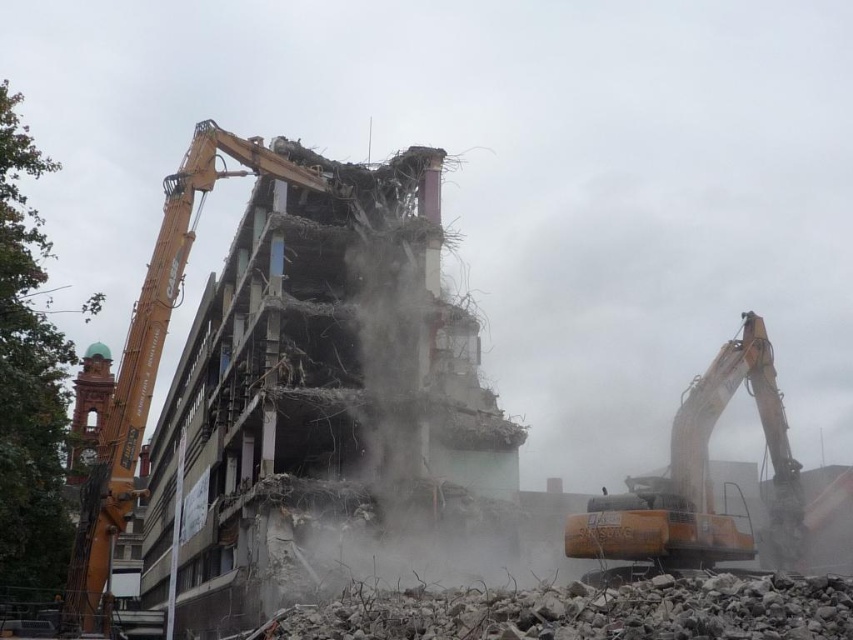
Is orange metallic excavator at right to the right of orange metallic crane at left from the viewer's perspective?

Yes, orange metallic excavator at right is to the right of orange metallic crane at left.

The height and width of the screenshot is (640, 853). Find the location of `orange metallic excavator at right`. orange metallic excavator at right is located at coordinates (700, 477).

Is point (737, 525) behind point (74, 579)?

No, (737, 525) is in front of (74, 579).

You are a GUI agent. You are given a task and a screenshot of the screen. Output one action in this format:
    pyautogui.click(x=<x>, y=<y>)
    Task: Click on the orange metallic excavator at right
    This screenshot has width=853, height=640.
    Given the screenshot: What is the action you would take?
    pyautogui.click(x=700, y=477)